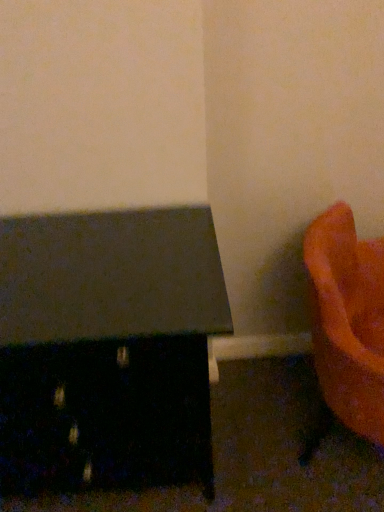
Image resolution: width=384 pixels, height=512 pixels. In order to click on orange matte vase at lower right, the second furniture from the left in this screenshot , I will do `click(348, 320)`.

Describe the element at coordinates (348, 320) in the screenshot. I see `orange matte vase at lower right, positioned as the first furniture in right-to-left order` at that location.

Measure the distance between point (51,257) and camera.

The distance of point (51,257) from camera is 1.06 meters.

What do you see at coordinates (108, 348) in the screenshot?
I see `matte black table at left, the first furniture in the left-to-right sequence` at bounding box center [108, 348].

In order to click on matte black table at left, the first furniture in the left-to-right sequence in this screenshot , I will do `click(108, 348)`.

Identify the location of orange matte vase at lower right, the second furniture from the left. (348, 320).

Based on their positions, is matte black table at left, which is the 2th furniture in right-to-left order, located to the left or right of orange matte vase at lower right, the second furniture from the left?

From the image, it's evident that matte black table at left, which is the 2th furniture in right-to-left order, is to the left of orange matte vase at lower right, the second furniture from the left.

Which object is further away from the camera, matte black table at left, the first furniture in the left-to-right sequence, or orange matte vase at lower right, positioned as the first furniture in right-to-left order?

matte black table at left, the first furniture in the left-to-right sequence.

Does point (29, 317) appear closer or farther from the camera than point (351, 229)?

Point (29, 317) is positioned closer to the camera compared to point (351, 229).

From the image's perspective, is matte black table at left, the first furniture in the left-to-right sequence, beneath orange matte vase at lower right, the second furniture from the left?

Yes, from the image's perspective, matte black table at left, the first furniture in the left-to-right sequence, is beneath orange matte vase at lower right, the second furniture from the left.

From a real-world perspective, which is physically below, matte black table at left, which is the 2th furniture in right-to-left order, or orange matte vase at lower right, positioned as the first furniture in right-to-left order?

In real-world perspective, orange matte vase at lower right, positioned as the first furniture in right-to-left order, is lower.

Does matte black table at left, which is the 2th furniture in right-to-left order, have a lesser width compared to orange matte vase at lower right, the second furniture from the left?

No, matte black table at left, which is the 2th furniture in right-to-left order, is not thinner than orange matte vase at lower right, the second furniture from the left.

Can you confirm if matte black table at left, the first furniture in the left-to-right sequence, is taller than orange matte vase at lower right, positioned as the first furniture in right-to-left order?

Yes, matte black table at left, the first furniture in the left-to-right sequence, is taller than orange matte vase at lower right, positioned as the first furniture in right-to-left order.

Between matte black table at left, which is the 2th furniture in right-to-left order, and orange matte vase at lower right, the second furniture from the left, which one has larger size?

matte black table at left, which is the 2th furniture in right-to-left order, is bigger.

Is orange matte vase at lower right, the second furniture from the left, a part of matte black table at left, the first furniture in the left-to-right sequence?

No, orange matte vase at lower right, the second furniture from the left, is not a part of matte black table at left, the first furniture in the left-to-right sequence.

Is matte black table at left, the first furniture in the left-to-right sequence, not near orange matte vase at lower right, the second furniture from the left?

They are positioned close to each other.

Could you tell me if matte black table at left, the first furniture in the left-to-right sequence, is turned towards orange matte vase at lower right, the second furniture from the left?

No, matte black table at left, the first furniture in the left-to-right sequence, does not turn towards orange matte vase at lower right, the second furniture from the left.

Where is `furniture that appears below the matte black table at left, the first furniture in the left-to-right sequence (from a real-world perspective)`? furniture that appears below the matte black table at left, the first furniture in the left-to-right sequence (from a real-world perspective) is located at coordinates (348, 320).

Considering the relative positions of orange matte vase at lower right, the second furniture from the left, and matte black table at left, which is the 2th furniture in right-to-left order, in the image provided, is orange matte vase at lower right, the second furniture from the left, to the right of matte black table at left, which is the 2th furniture in right-to-left order, from the viewer's perspective?

Yes.

Who is more distant, orange matte vase at lower right, positioned as the first furniture in right-to-left order, or matte black table at left, the first furniture in the left-to-right sequence?

matte black table at left, the first furniture in the left-to-right sequence, is further away from the camera.

Is point (335, 394) closer to camera compared to point (117, 422)?

No, it is behind (117, 422).

From the image's perspective, is orange matte vase at lower right, positioned as the first furniture in right-to-left order, located above or below matte black table at left, which is the 2th furniture in right-to-left order?

Based on their image positions, orange matte vase at lower right, positioned as the first furniture in right-to-left order, is located above matte black table at left, which is the 2th furniture in right-to-left order.

From a real-world perspective, is orange matte vase at lower right, the second furniture from the left, physically above matte black table at left, which is the 2th furniture in right-to-left order?

Incorrect, from a real-world perspective, orange matte vase at lower right, the second furniture from the left, is lower than matte black table at left, which is the 2th furniture in right-to-left order.

Considering the sizes of objects orange matte vase at lower right, the second furniture from the left, and matte black table at left, the first furniture in the left-to-right sequence, in the image provided, who is wider, orange matte vase at lower right, the second furniture from the left, or matte black table at left, the first furniture in the left-to-right sequence,?

matte black table at left, the first furniture in the left-to-right sequence, is wider.

Between orange matte vase at lower right, positioned as the first furniture in right-to-left order, and matte black table at left, the first furniture in the left-to-right sequence, which one has less height?

Standing shorter between the two is orange matte vase at lower right, positioned as the first furniture in right-to-left order.

Looking at the image, does orange matte vase at lower right, the second furniture from the left, seem bigger or smaller compared to matte black table at left, which is the 2th furniture in right-to-left order?

Clearly, orange matte vase at lower right, the second furniture from the left, is smaller in size than matte black table at left, which is the 2th furniture in right-to-left order.

In the scene shown: Is orange matte vase at lower right, positioned as the first furniture in right-to-left order, outside of matte black table at left, the first furniture in the left-to-right sequence?

orange matte vase at lower right, positioned as the first furniture in right-to-left order, lies outside matte black table at left, the first furniture in the left-to-right sequence,'s area.

Is orange matte vase at lower right, the second furniture from the left, far away from matte black table at left, which is the 2th furniture in right-to-left order?

No, orange matte vase at lower right, the second furniture from the left, is in close proximity to matte black table at left, which is the 2th furniture in right-to-left order.

Is orange matte vase at lower right, positioned as the first furniture in right-to-left order, aimed at matte black table at left, which is the 2th furniture in right-to-left order?

No, orange matte vase at lower right, positioned as the first furniture in right-to-left order, is not oriented towards matte black table at left, which is the 2th furniture in right-to-left order.

What's the angular difference between orange matte vase at lower right, the second furniture from the left, and matte black table at left, the first furniture in the left-to-right sequence,'s facing directions?

There is a 59.2-degree angle between the facing directions of orange matte vase at lower right, the second furniture from the left, and matte black table at left, the first furniture in the left-to-right sequence.

How distant is orange matte vase at lower right, positioned as the first furniture in right-to-left order, from matte black table at left, which is the 2th furniture in right-to-left order?

orange matte vase at lower right, positioned as the first furniture in right-to-left order, is 19.91 inches away from matte black table at left, which is the 2th furniture in right-to-left order.

Where is `furniture above the matte black table at left, which is the 2th furniture in right-to-left order (from the image's perspective)`? The height and width of the screenshot is (512, 384). furniture above the matte black table at left, which is the 2th furniture in right-to-left order (from the image's perspective) is located at coordinates (348, 320).

Where is `furniture that appears on the left of orange matte vase at lower right, the second furniture from the left`? This screenshot has height=512, width=384. furniture that appears on the left of orange matte vase at lower right, the second furniture from the left is located at coordinates (108, 348).

Find the location of a particular element. This screenshot has height=512, width=384. furniture located below the orange matte vase at lower right, the second furniture from the left (from the image's perspective) is located at coordinates click(108, 348).